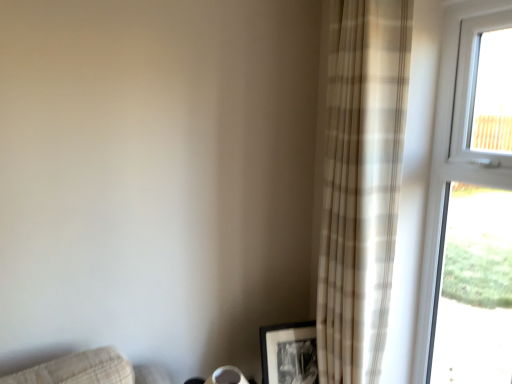
In order to face beige plaid curtain at right, should I rotate leftwards or rightwards?

Turn right by 12.427 degrees to look at beige plaid curtain at right.

This screenshot has height=384, width=512. What are the coordinates of `black matte picture frame at lower right` in the screenshot? It's located at (289, 353).

Find the location of a particular element. Image resolution: width=512 pixels, height=384 pixels. beige plaid curtain at right is located at coordinates (361, 184).

Looking at this image, considering the sizes of objects white plastic window at upper right and black matte picture frame at lower right in the image provided, who is shorter, white plastic window at upper right or black matte picture frame at lower right?

black matte picture frame at lower right is shorter.

Is white plastic window at upper right placed right next to black matte picture frame at lower right?

No.

From the image's perspective, relative to black matte picture frame at lower right, is white plastic window at upper right above or below?

white plastic window at upper right is above black matte picture frame at lower right.

Considering the relative sizes of white plastic window at upper right and black matte picture frame at lower right in the image provided, is white plastic window at upper right bigger than black matte picture frame at lower right?

Yes.

From a real-world perspective, is black matte picture frame at lower right physically below beige plaid curtain at right?

Yes, from a real-world perspective, black matte picture frame at lower right is under beige plaid curtain at right.

The width and height of the screenshot is (512, 384). I want to click on curtain above the black matte picture frame at lower right (from the image's perspective), so click(x=361, y=184).

Is black matte picture frame at lower right to the left or to the right of beige plaid curtain at right in the image?

In the image, black matte picture frame at lower right appears on the left side of beige plaid curtain at right.

Is black matte picture frame at lower right oriented away from beige plaid curtain at right?

Yes, beige plaid curtain at right is at the back of black matte picture frame at lower right.

This screenshot has width=512, height=384. In order to click on window below the beige plaid curtain at right (from the image's perspective) in this screenshot , I will do `click(469, 210)`.

Considering the relative positions of white plastic window at upper right and beige plaid curtain at right in the image provided, is white plastic window at upper right to the left or to the right of beige plaid curtain at right?

white plastic window at upper right is positioned on beige plaid curtain at right's right side.

From a real-world perspective, who is located lower, white plastic window at upper right or beige plaid curtain at right?

In real-world perspective, white plastic window at upper right is lower.

Considering the positions of objects white plastic window at upper right and beige plaid curtain at right in the image provided, who is behind, white plastic window at upper right or beige plaid curtain at right?

beige plaid curtain at right is behind.

Is black matte picture frame at lower right facing away from white plastic window at upper right?

No.

Considering the sizes of objects black matte picture frame at lower right and white plastic window at upper right in the image provided, who is wider, black matte picture frame at lower right or white plastic window at upper right?

black matte picture frame at lower right is wider.

Is black matte picture frame at lower right at the right side of white plastic window at upper right?

Incorrect, black matte picture frame at lower right is not on the right side of white plastic window at upper right.

Considering the positions of points (262, 362) and (470, 344), is point (262, 362) closer to camera compared to point (470, 344)?

Yes, point (262, 362) is closer to viewer.

Is beige plaid curtain at right placed right next to white plastic window at upper right?

There is a gap between beige plaid curtain at right and white plastic window at upper right.

Which is behind, beige plaid curtain at right or white plastic window at upper right?

beige plaid curtain at right is behind.

Considering the relative positions of beige plaid curtain at right and white plastic window at upper right in the image provided, is beige plaid curtain at right to the left of white plastic window at upper right from the viewer's perspective?

Yes.

Considering the positions of points (386, 221) and (303, 342), is point (386, 221) closer to camera compared to point (303, 342)?

Yes.

The height and width of the screenshot is (384, 512). I want to click on curtain above the black matte picture frame at lower right (from a real-world perspective), so [x=361, y=184].

From a real-world perspective, between beige plaid curtain at right and black matte picture frame at lower right, who is vertically higher?

beige plaid curtain at right is physically above.

Is beige plaid curtain at right oriented towards black matte picture frame at lower right?

Yes.

Where is `window to the right of black matte picture frame at lower right`? The image size is (512, 384). window to the right of black matte picture frame at lower right is located at coordinates (469, 210).

I want to click on curtain above the black matte picture frame at lower right (from the image's perspective), so click(x=361, y=184).

Looking at the image, which one is located further to black matte picture frame at lower right, white plastic window at upper right or beige plaid curtain at right?

Based on the image, white plastic window at upper right appears to be further to black matte picture frame at lower right.

Considering their positions, is black matte picture frame at lower right positioned closer to beige plaid curtain at right than white plastic window at upper right?

Based on the image, white plastic window at upper right appears to be nearer to beige plaid curtain at right.

From the image, which object appears to be farther from beige plaid curtain at right, white plastic window at upper right or black matte picture frame at lower right?

black matte picture frame at lower right is positioned further to the anchor beige plaid curtain at right.

When comparing their distances from white plastic window at upper right, does black matte picture frame at lower right or beige plaid curtain at right seem closer?

Based on the image, beige plaid curtain at right appears to be nearer to white plastic window at upper right.

Considering their positions, is beige plaid curtain at right positioned closer to black matte picture frame at lower right than white plastic window at upper right?

beige plaid curtain at right is positioned closer to the anchor black matte picture frame at lower right.

Which object lies further to the anchor point white plastic window at upper right, beige plaid curtain at right or black matte picture frame at lower right?

black matte picture frame at lower right lies further to white plastic window at upper right than the other object.

Locate an element on the screen. The image size is (512, 384). window that lies between beige plaid curtain at right and black matte picture frame at lower right from top to bottom is located at coordinates tap(469, 210).